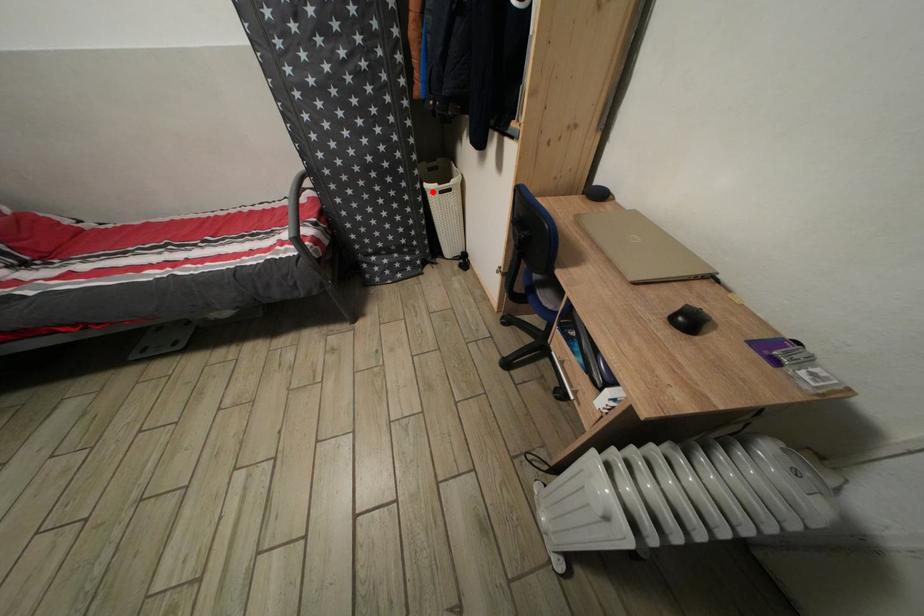
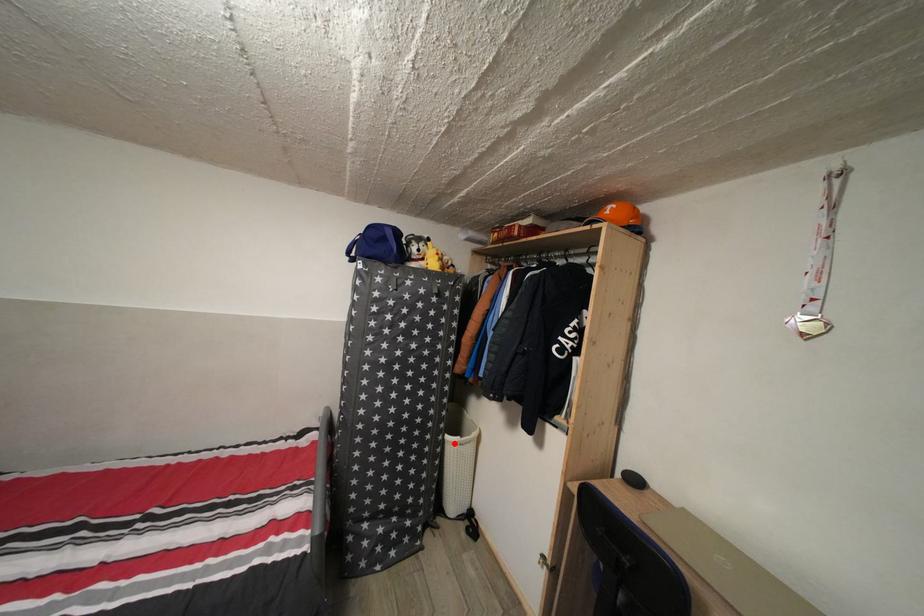
I am providing you with two images of the same scene from different viewpoints. A red point is marked on the first image and another point is marked on the second image. Is the red point in image1 aligned with the point shown in image2?

Yes